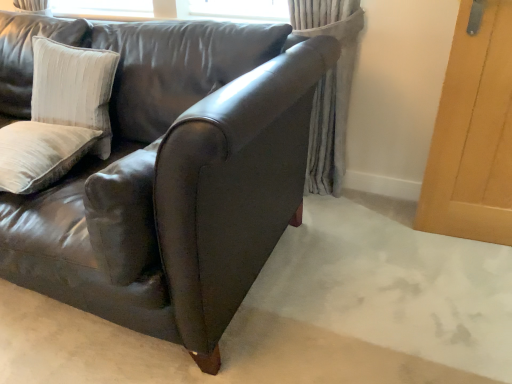
Question: From a real-world perspective, is velvet beige pillow at upper left, which is the 1th pillow from top to bottom, physically located above or below gray textured curtain at center?

Choices:
 (A) above
 (B) below

Answer: (A)

Question: Based on their positions, is velvet beige pillow at upper left, which is the 1th pillow from top to bottom, located to the left or right of gray textured curtain at center?

Choices:
 (A) right
 (B) left

Answer: (B)

Question: Considering the real-world distances, which object is farthest from the gray textured curtain at center?

Choices:
 (A) velvet beige pillow at upper left, which is the 1th pillow from top to bottom
 (B) beige velvet pillow at left, marked as the 1th pillow in a bottom-to-top arrangement
 (C) shiny leather couch at center

Answer: (B)

Question: Estimate the real-world distances between objects in this image. Which object is closer to the gray textured curtain at center?

Choices:
 (A) beige velvet pillow at left, which appears as the 2th pillow when viewed from the top
 (B) velvet beige pillow at upper left, which is counted as the 2th pillow, starting from the bottom
 (C) shiny leather couch at center

Answer: (C)